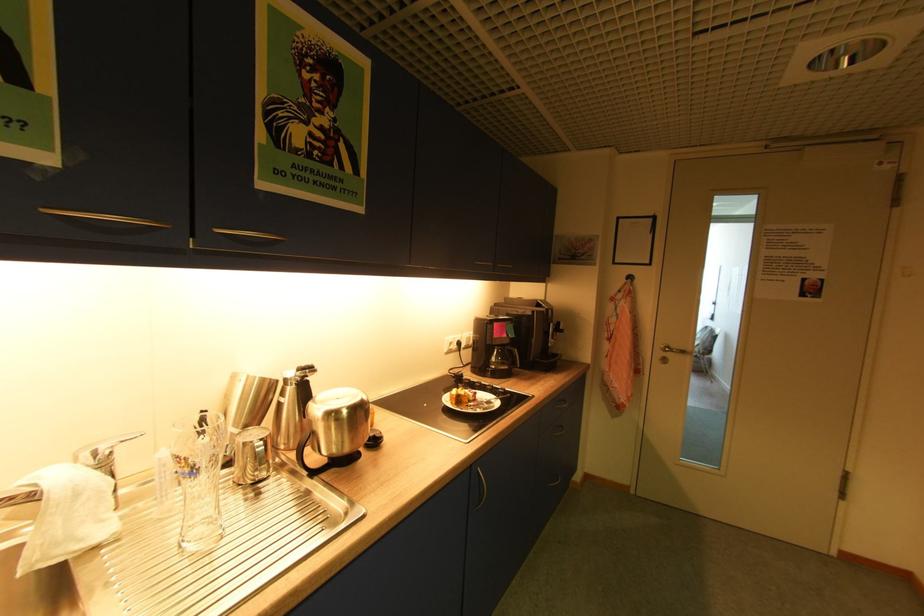
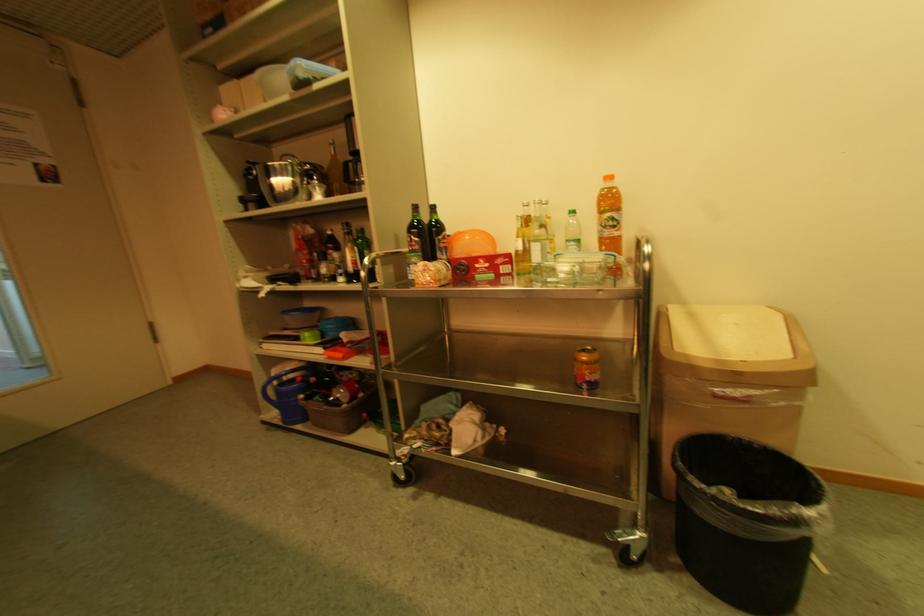
Based on the continuous images, in which direction is the camera rotating?

The camera rotated toward right-down.